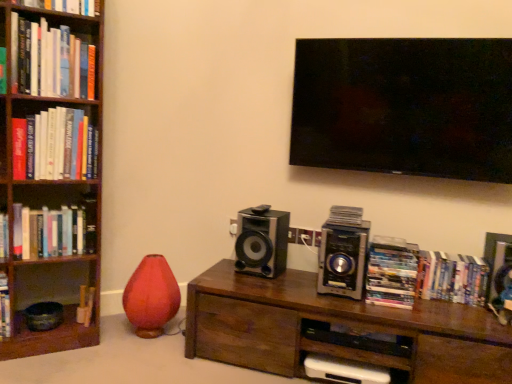
In order to click on free spot to the right of wooden bookshelf at left in this screenshot , I will do `click(114, 346)`.